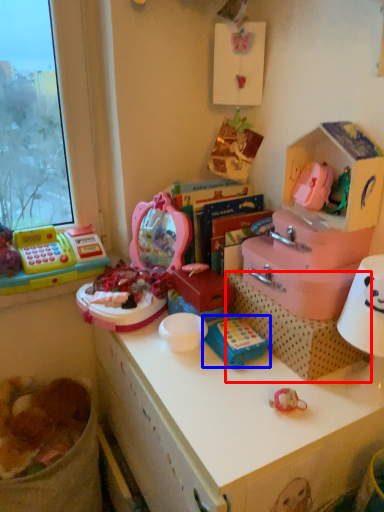
Question: Which object is closer to the camera taking this photo, cardboard box (highlighted by a red box) or toy (highlighted by a blue box)?

Choices:
 (A) cardboard box
 (B) toy

Answer: (A)